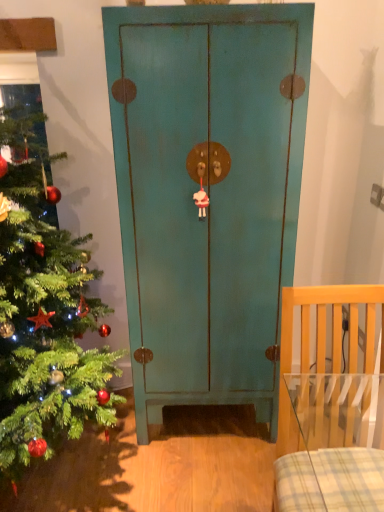
Question: Can you confirm if green matte christmas tree at left is taller than light wood chair at right?

Choices:
 (A) yes
 (B) no

Answer: (A)

Question: From a real-world perspective, is green matte christmas tree at left physically below light wood chair at right?

Choices:
 (A) yes
 (B) no

Answer: (B)

Question: Can we say green matte christmas tree at left lies outside light wood chair at right?

Choices:
 (A) yes
 (B) no

Answer: (A)

Question: Is green matte christmas tree at left oriented towards light wood chair at right?

Choices:
 (A) yes
 (B) no

Answer: (B)

Question: From the image's perspective, is green matte christmas tree at left under light wood chair at right?

Choices:
 (A) yes
 (B) no

Answer: (B)

Question: From the image's perspective, is light wood chair at right located above or below teal matte cabinet at center?

Choices:
 (A) above
 (B) below

Answer: (B)

Question: Would you say light wood chair at right is inside or outside teal matte cabinet at center?

Choices:
 (A) inside
 (B) outside

Answer: (B)

Question: Visually, is light wood chair at right positioned to the left or to the right of teal matte cabinet at center?

Choices:
 (A) left
 (B) right

Answer: (B)

Question: Considering their positions, is light wood chair at right located in front of or behind teal matte cabinet at center?

Choices:
 (A) behind
 (B) front

Answer: (B)

Question: From the image's perspective, is green matte christmas tree at left positioned above or below teal matte cabinet at center?

Choices:
 (A) above
 (B) below

Answer: (B)

Question: Is green matte christmas tree at left inside the boundaries of teal matte cabinet at center, or outside?

Choices:
 (A) inside
 (B) outside

Answer: (B)

Question: From a real-world perspective, is green matte christmas tree at left physically located above or below teal matte cabinet at center?

Choices:
 (A) below
 (B) above

Answer: (B)

Question: Considering their positions, is green matte christmas tree at left located in front of or behind teal matte cabinet at center?

Choices:
 (A) front
 (B) behind

Answer: (A)

Question: Considering the positions of point (248, 236) and point (344, 450), is point (248, 236) closer or farther from the camera than point (344, 450)?

Choices:
 (A) closer
 (B) farther

Answer: (B)

Question: Looking at their shapes, would you say teal matte cabinet at center is wider or thinner than light wood chair at right?

Choices:
 (A) thin
 (B) wide

Answer: (A)